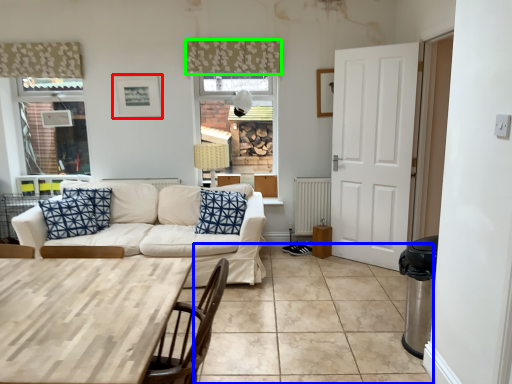
Question: Estimate the real-world distances between objects in this image. Which object is farther from picture frame (highlighted by a red box), tile (highlighted by a blue box) or curtain (highlighted by a green box)?

Choices:
 (A) tile
 (B) curtain

Answer: (A)